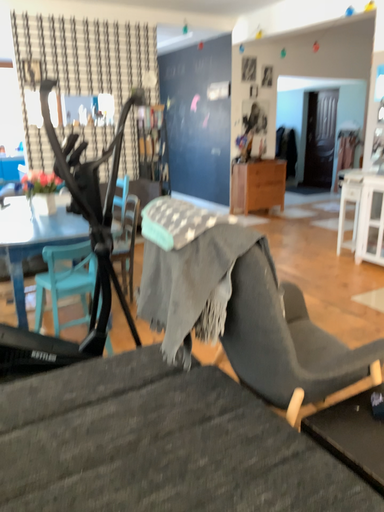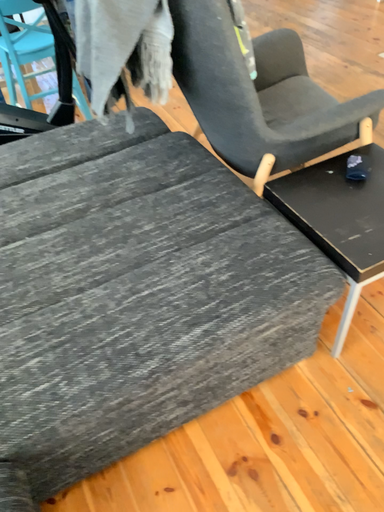
Question: Which way did the camera rotate in the video?

Choices:
 (A) rotated upward
 (B) rotated downward

Answer: (B)